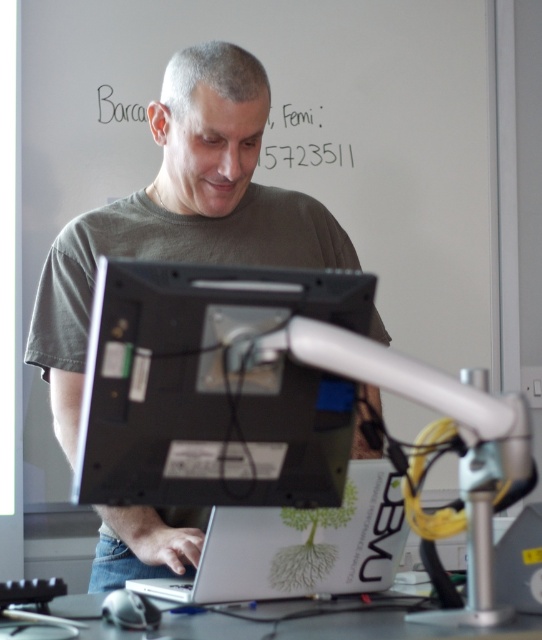
Question: Does silver metallic laptop at center come in front of white plastic table at lower center?

Choices:
 (A) no
 (B) yes

Answer: (A)

Question: Is silver metallic laptop at center to the left of black paper at upper center from the viewer's perspective?

Choices:
 (A) yes
 (B) no

Answer: (A)

Question: Which of these objects is positioned farthest from the black paper at upper center?

Choices:
 (A) matte green t-shirt at center
 (B) black glossy monitor at center

Answer: (B)

Question: Among these objects, which one is farthest from the camera?

Choices:
 (A) matte green t-shirt at center
 (B) black glossy monitor at center
 (C) white plastic table at lower center

Answer: (A)

Question: Which object appears closest to the camera in this image?

Choices:
 (A) black paper at upper center
 (B) matte green t-shirt at center
 (C) black glossy monitor at center

Answer: (C)

Question: Can you confirm if black glossy monitor at center is positioned below black paper at upper center?

Choices:
 (A) yes
 (B) no

Answer: (A)